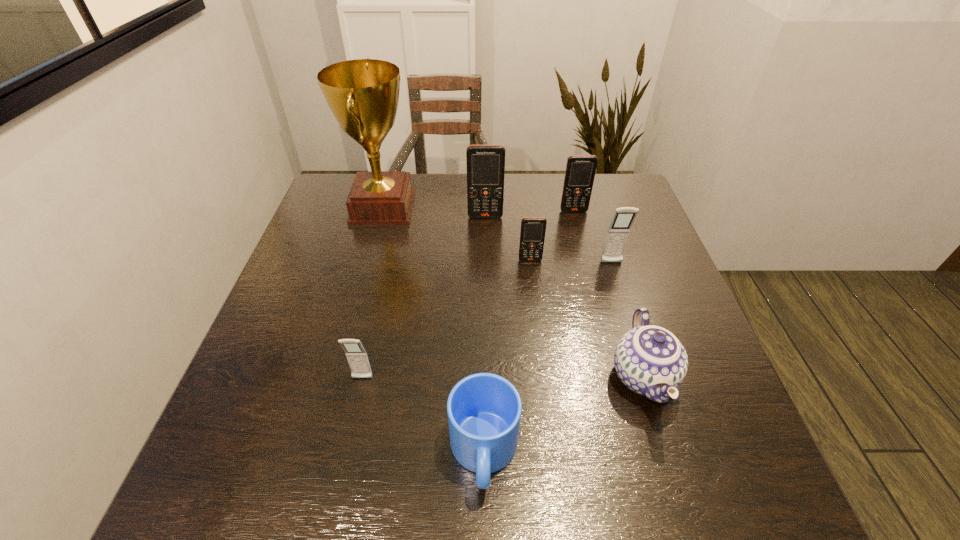
The height and width of the screenshot is (540, 960). In order to click on empty space between the farthest cellular telephone and the leftmost orange cellular telephone in this screenshot , I will do `click(530, 214)`.

Where is `unoccupied area between the farther gray cellular telephone and the mug`? The width and height of the screenshot is (960, 540). unoccupied area between the farther gray cellular telephone and the mug is located at coordinates (548, 358).

I want to click on blank region between the leftmost cellular telephone and the second tallest object, so click(x=424, y=298).

The image size is (960, 540). I want to click on free space between the gold award and the chinaware, so click(x=513, y=292).

This screenshot has height=540, width=960. In order to click on the sixth closest object to the mug in this screenshot , I will do `click(485, 163)`.

Identify the location of object that is the fourth closest to the right gray cellular telephone. The width and height of the screenshot is (960, 540). pos(485,163).

I want to click on the second closest cellular telephone to the gold award, so click(532, 235).

Find the location of a particular element. Image resolution: width=960 pixels, height=540 pixels. cellular telephone object that ranks as the fifth closest to the mug is located at coordinates (580, 172).

The image size is (960, 540). Find the location of `orange cellular telephone that is the closest one to the mug`. orange cellular telephone that is the closest one to the mug is located at coordinates (532, 235).

Where is `orange cellular telephone that stands as the second closest to the rightmost orange cellular telephone`? The width and height of the screenshot is (960, 540). orange cellular telephone that stands as the second closest to the rightmost orange cellular telephone is located at coordinates (532, 235).